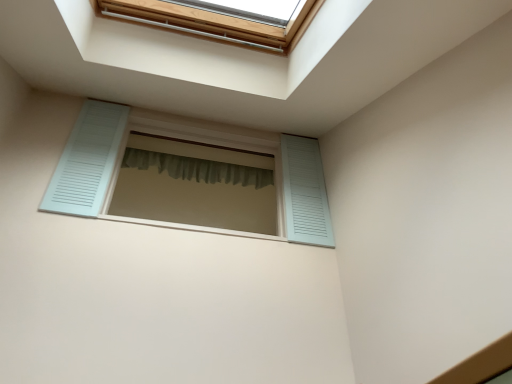
Describe the element at coordinates (182, 138) in the screenshot. I see `light blue wooden shutters at center` at that location.

Find the location of `light blue wooden shutters at center`. light blue wooden shutters at center is located at coordinates (182, 138).

This screenshot has width=512, height=384. What do you see at coordinates (198, 168) in the screenshot? I see `green fabric shower curtain at center` at bounding box center [198, 168].

Find the location of a particular element. This screenshot has height=384, width=512. green fabric shower curtain at center is located at coordinates (198, 168).

Where is `light blue wooden shutters at center`? This screenshot has width=512, height=384. light blue wooden shutters at center is located at coordinates (182, 138).

In the image, is light blue wooden shutters at center on the left side or the right side of green fabric shower curtain at center?

light blue wooden shutters at center is positioned on green fabric shower curtain at center's right side.

Which is in front, light blue wooden shutters at center or green fabric shower curtain at center?

light blue wooden shutters at center.

Is point (102, 201) positioned behind point (238, 182)?

No, (102, 201) is in front of (238, 182).

From the image's perspective, does light blue wooden shutters at center appear lower than green fabric shower curtain at center?

Yes, from the image's perspective, light blue wooden shutters at center is beneath green fabric shower curtain at center.

From a real-world perspective, is light blue wooden shutters at center positioned under green fabric shower curtain at center based on gravity?

Yes, from a real-world perspective, light blue wooden shutters at center is beneath green fabric shower curtain at center.

Between light blue wooden shutters at center and green fabric shower curtain at center, which one has larger width?

Wider between the two is light blue wooden shutters at center.

Does light blue wooden shutters at center have a lesser height compared to green fabric shower curtain at center?

No.

Does light blue wooden shutters at center have a smaller size compared to green fabric shower curtain at center?

Incorrect, light blue wooden shutters at center is not smaller in size than green fabric shower curtain at center.

Is light blue wooden shutters at center not inside green fabric shower curtain at center?

Yes.

In the scene shown: Is light blue wooden shutters at center not near green fabric shower curtain at center?

light blue wooden shutters at center is actually quite close to green fabric shower curtain at center.

Is light blue wooden shutters at center facing away from green fabric shower curtain at center?

Yes, light blue wooden shutters at center is positioned with its back facing green fabric shower curtain at center.

Find the location of a particular element. The image size is (512, 384). shower curtain above the light blue wooden shutters at center (from the image's perspective) is located at coordinates (198, 168).

Which object is positioned more to the right, green fabric shower curtain at center or light blue wooden shutters at center?

light blue wooden shutters at center.

Considering their positions, is green fabric shower curtain at center located in front of or behind light blue wooden shutters at center?

Visually, green fabric shower curtain at center is located behind light blue wooden shutters at center.

Which is more distant, (138, 154) or (80, 215)?

Point (138, 154)

From the image's perspective, is green fabric shower curtain at center located beneath light blue wooden shutters at center?

No, from the image's perspective, green fabric shower curtain at center is not below light blue wooden shutters at center.

From a real-world perspective, is green fabric shower curtain at center over light blue wooden shutters at center?

Yes.

Between green fabric shower curtain at center and light blue wooden shutters at center, which one has smaller width?

With smaller width is green fabric shower curtain at center.

Considering the relative sizes of green fabric shower curtain at center and light blue wooden shutters at center in the image provided, is green fabric shower curtain at center shorter than light blue wooden shutters at center?

Indeed, green fabric shower curtain at center has a lesser height compared to light blue wooden shutters at center.

Considering the sizes of green fabric shower curtain at center and light blue wooden shutters at center in the image, is green fabric shower curtain at center bigger or smaller than light blue wooden shutters at center?

Considering their sizes, green fabric shower curtain at center takes up less space than light blue wooden shutters at center.

Is green fabric shower curtain at center spatially inside light blue wooden shutters at center, or outside of it?

green fabric shower curtain at center is spatially situated outside light blue wooden shutters at center.

Are green fabric shower curtain at center and light blue wooden shutters at center beside each other?

No, green fabric shower curtain at center is not with light blue wooden shutters at center.

Could you tell me if green fabric shower curtain at center is turned towards light blue wooden shutters at center?

Yes, green fabric shower curtain at center is oriented towards light blue wooden shutters at center.

The image size is (512, 384). What are the coordinates of `window below the green fabric shower curtain at center (from the image's perspective)` in the screenshot? It's located at (182, 138).

Where is `shower curtain that is above the light blue wooden shutters at center (from a real-world perspective)`? shower curtain that is above the light blue wooden shutters at center (from a real-world perspective) is located at coordinates (198, 168).

Find the location of a particular element. shower curtain that appears behind the light blue wooden shutters at center is located at coordinates (198, 168).